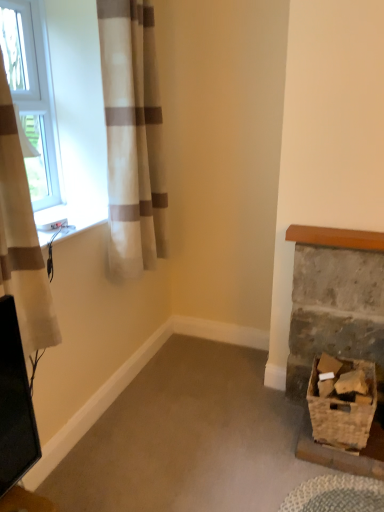
Question: Is white textured curtain at left, marked as the first curtain in a front-to-back arrangement, closer to camera compared to white plastic window at upper left?

Choices:
 (A) yes
 (B) no

Answer: (A)

Question: Does white textured curtain at left, acting as the 1th curtain starting from the left, have a greater height compared to white plastic window at upper left?

Choices:
 (A) yes
 (B) no

Answer: (A)

Question: Considering the relative sizes of white textured curtain at left, acting as the 1th curtain starting from the left, and white plastic window at upper left in the image provided, is white textured curtain at left, acting as the 1th curtain starting from the left, thinner than white plastic window at upper left?

Choices:
 (A) no
 (B) yes

Answer: (A)

Question: From a real-world perspective, is white textured curtain at left, acting as the 1th curtain starting from the left, over white plastic window at upper left?

Choices:
 (A) no
 (B) yes

Answer: (A)

Question: Is white textured curtain at left, marked as the first curtain in a front-to-back arrangement, outside white plastic window at upper left?

Choices:
 (A) yes
 (B) no

Answer: (A)

Question: Visually, is white sheer curtain at left, which ranks as the 2th curtain in front-to-back order, positioned to the left or to the right of white plastic window at upper left?

Choices:
 (A) right
 (B) left

Answer: (A)

Question: From the image's perspective, is white sheer curtain at left, the first curtain from the back, above or below white plastic window at upper left?

Choices:
 (A) below
 (B) above

Answer: (A)

Question: Is white sheer curtain at left, the first curtain positioned from the right, wider or thinner than white plastic window at upper left?

Choices:
 (A) thin
 (B) wide

Answer: (B)

Question: In terms of height, does white sheer curtain at left, which ranks as the 2th curtain in front-to-back order, look taller or shorter compared to white plastic window at upper left?

Choices:
 (A) tall
 (B) short

Answer: (A)

Question: Looking at their shapes, would you say white sheer curtain at left, the first curtain from the back, is wider or thinner than woven brown basket at lower right?

Choices:
 (A) wide
 (B) thin

Answer: (B)

Question: Considering the positions of white sheer curtain at left, the first curtain positioned from the right, and woven brown basket at lower right in the image, is white sheer curtain at left, the first curtain positioned from the right, bigger or smaller than woven brown basket at lower right?

Choices:
 (A) small
 (B) big

Answer: (B)

Question: From the image's perspective, is white sheer curtain at left, the first curtain from the back, located above or below woven brown basket at lower right?

Choices:
 (A) above
 (B) below

Answer: (A)

Question: Is white sheer curtain at left, the first curtain from the back, spatially inside woven brown basket at lower right, or outside of it?

Choices:
 (A) inside
 (B) outside

Answer: (B)

Question: Is rustic wooden basket at lower right bigger or smaller than white textured curtain at left, the second curtain when ordered from right to left?

Choices:
 (A) big
 (B) small

Answer: (B)

Question: In the image, is rustic wooden basket at lower right positioned in front of or behind white textured curtain at left, the second curtain when ordered from back to front?

Choices:
 (A) front
 (B) behind

Answer: (B)